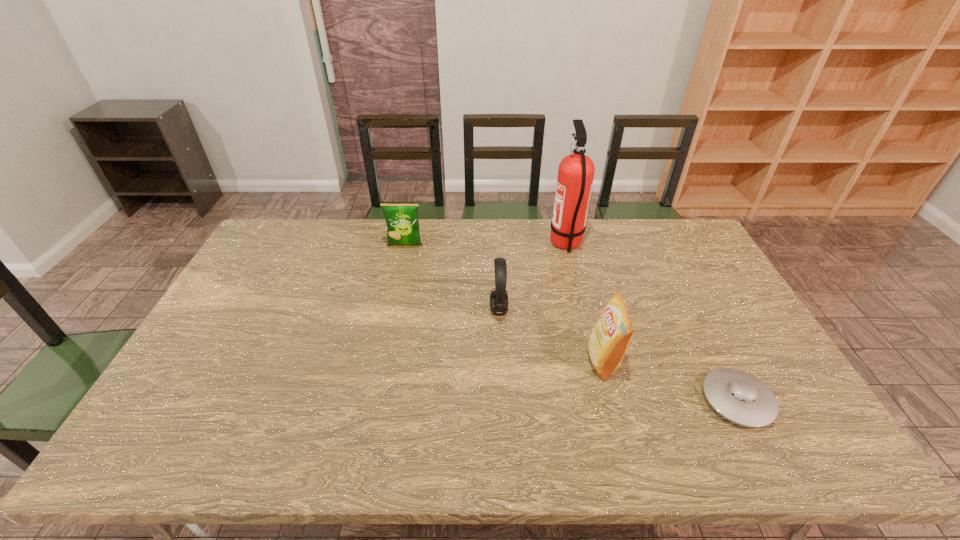
What are the coordinates of `fire extinguisher` in the screenshot? It's located at point(576,171).

This screenshot has width=960, height=540. What are the coordinates of `the right crisp (potato chip)` in the screenshot? It's located at (608, 341).

At what (x,y) coordinates should I click in order to perform the action: click on the left crisp (potato chip). Please return your answer as a coordinate pair (x, y). Image resolution: width=960 pixels, height=540 pixels. Looking at the image, I should click on (402, 221).

The height and width of the screenshot is (540, 960). In order to click on the leftmost object in this screenshot , I will do `click(402, 221)`.

The height and width of the screenshot is (540, 960). In order to click on the third nearest object in this screenshot , I will do `click(498, 298)`.

The width and height of the screenshot is (960, 540). Identify the location of the fourth object from right to left. click(x=498, y=298).

The image size is (960, 540). I want to click on saucer, so click(x=738, y=396).

In order to click on the shortest object in this screenshot , I will do `click(738, 396)`.

The image size is (960, 540). In order to click on free space located 0.340m on the handle side of the fire extinguisher in this screenshot , I will do `click(455, 244)`.

The width and height of the screenshot is (960, 540). I want to click on free space located on the handle side of the fire extinguisher, so click(x=447, y=244).